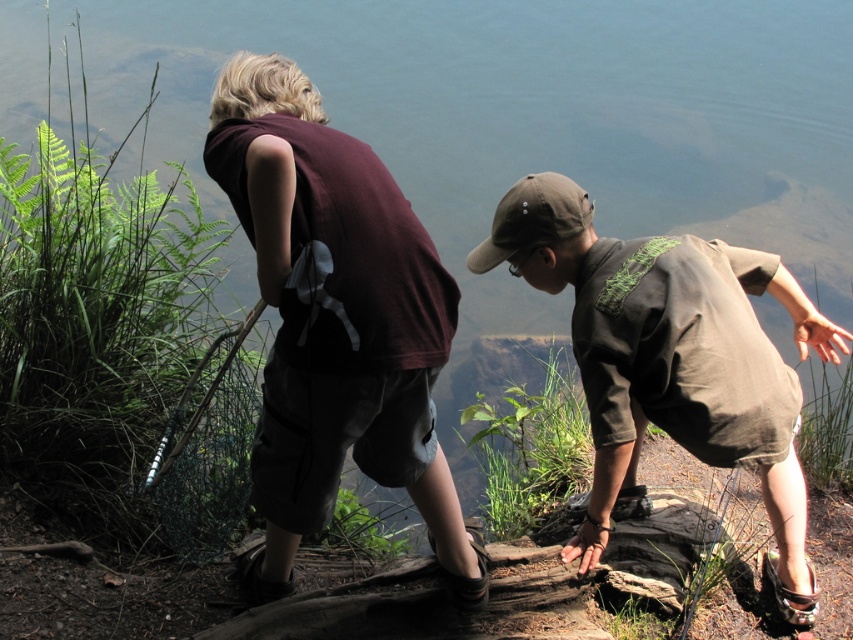
Question: Among these objects, which one is nearest to the camera?

Choices:
 (A) maroon fabric shirt at center
 (B) brown cotton shirt at center

Answer: (A)

Question: Can you confirm if maroon fabric shirt at center is positioned to the left of brown cotton shirt at center?

Choices:
 (A) yes
 (B) no

Answer: (A)

Question: Is maroon fabric shirt at center wider than brown cotton shirt at center?

Choices:
 (A) yes
 (B) no

Answer: (B)

Question: Among these points, which one is farthest from the camera?

Choices:
 (A) (370, 160)
 (B) (788, 436)

Answer: (B)

Question: From the image, what is the correct spatial relationship of maroon fabric shirt at center in relation to brown cotton shirt at center?

Choices:
 (A) above
 (B) below

Answer: (A)